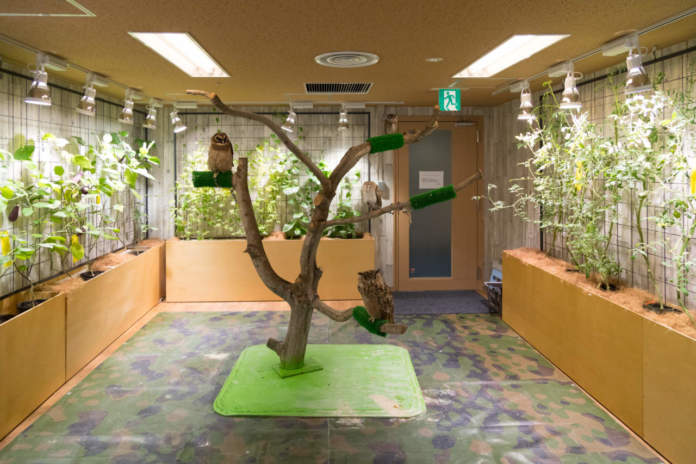
Where is `glass panel in door`? The height and width of the screenshot is (464, 696). glass panel in door is located at coordinates (429, 158).